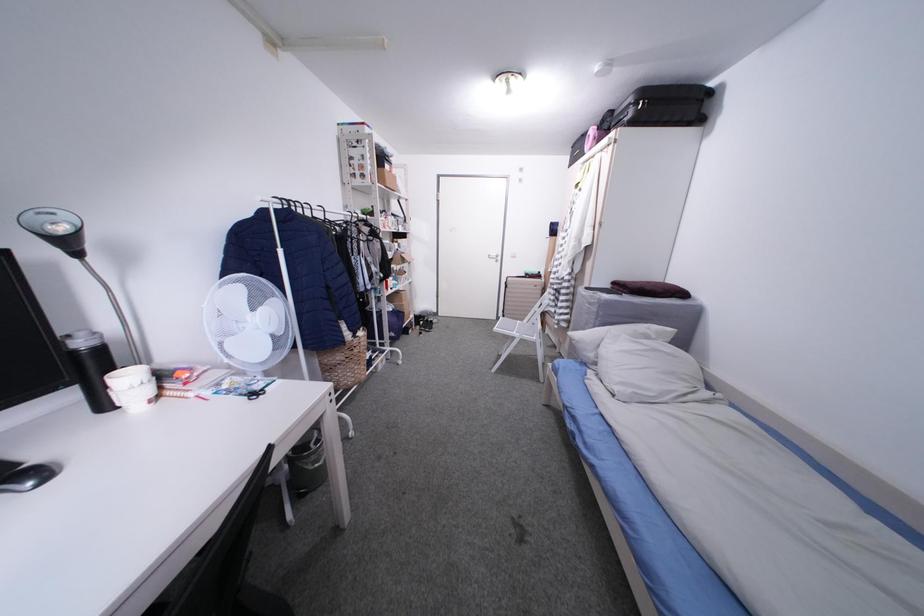
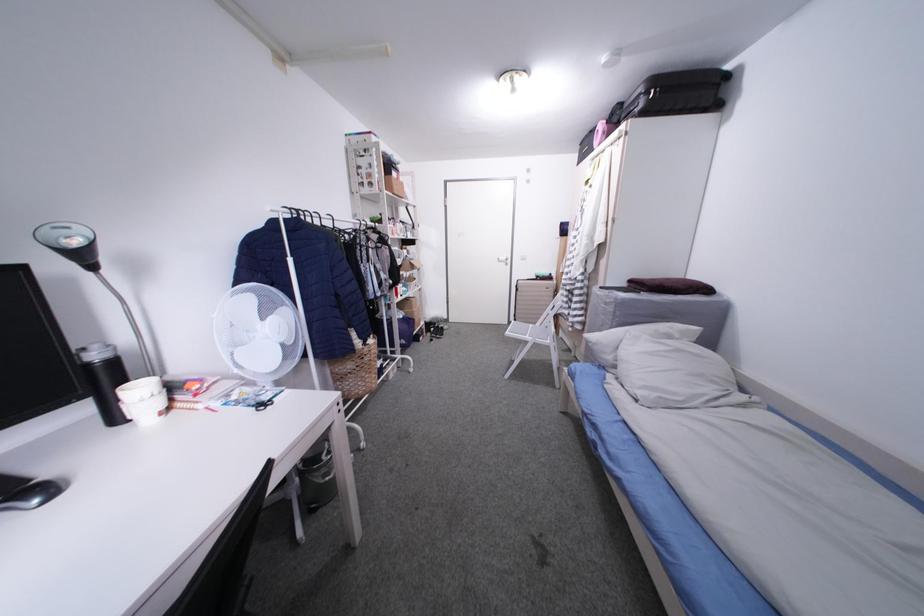
Question: In a continuous first-person perspective shot, in which direction is the camera moving?

Choices:
 (A) Left
 (B) Right
 (C) Forward
 (D) Backward

Answer: (C)